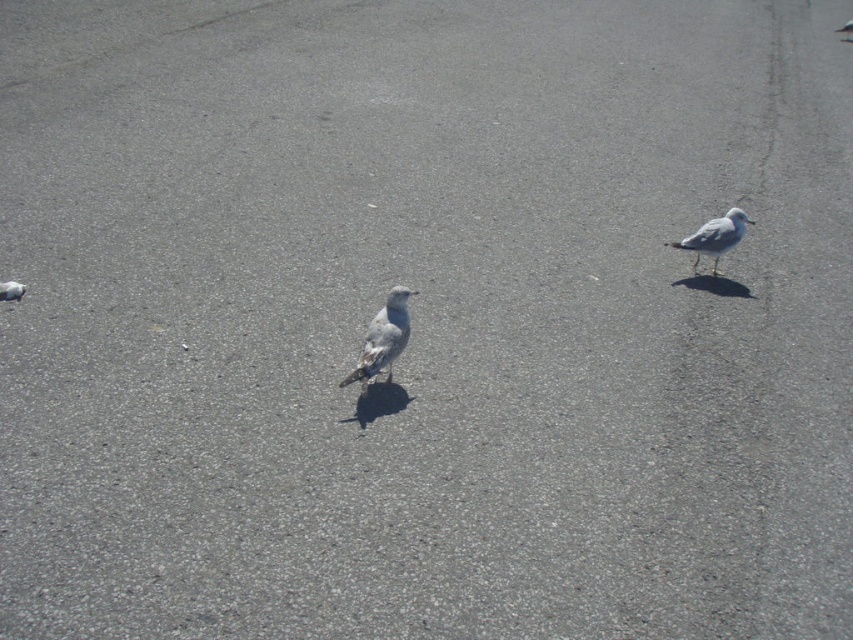
Question: Considering the real-world distances, which object is closest to the gray matte bird at center?

Choices:
 (A) white matte pigeon at right
 (B) gray matte pigeon at lower left

Answer: (B)

Question: Can you confirm if gray matte bird at center is positioned above white matte pigeon at right?

Choices:
 (A) yes
 (B) no

Answer: (B)

Question: Considering the real-world distances, which object is farthest from the gray matte pigeon at lower left?

Choices:
 (A) gray matte bird at center
 (B) white matte pigeon at right

Answer: (B)

Question: Is white matte pigeon at right further to camera compared to gray matte pigeon at lower left?

Choices:
 (A) no
 (B) yes

Answer: (B)

Question: Which point is closer to the camera?

Choices:
 (A) white matte pigeon at right
 (B) gray matte bird at center
 (C) gray matte pigeon at lower left

Answer: (B)

Question: Does gray matte bird at center appear under white matte pigeon at right?

Choices:
 (A) no
 (B) yes

Answer: (B)